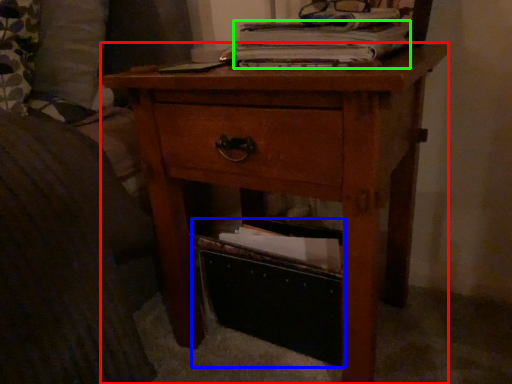
Question: Which is farther away from nightstand (highlighted by a red box)? storage box (highlighted by a blue box) or paperback book (highlighted by a green box)?

Choices:
 (A) storage box
 (B) paperback book

Answer: (B)